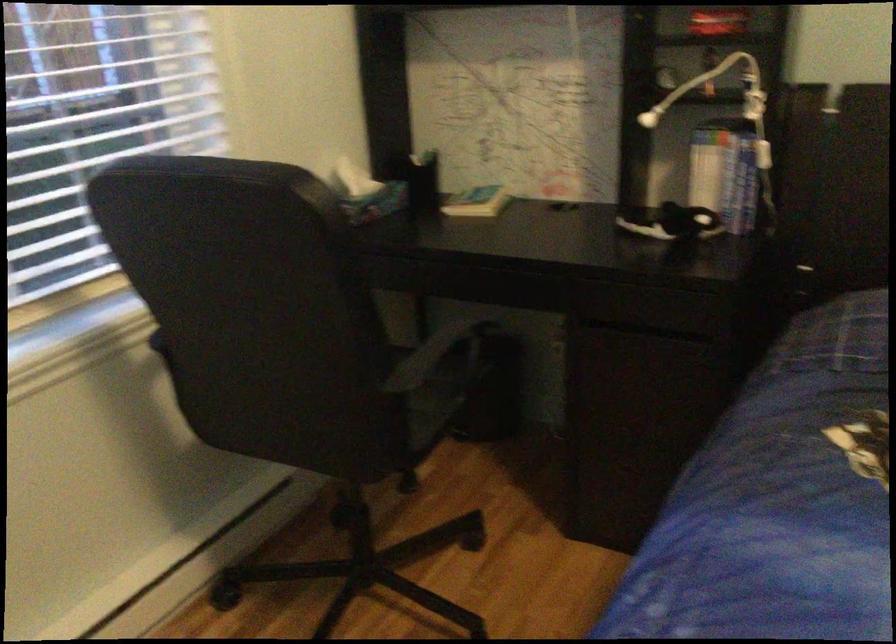
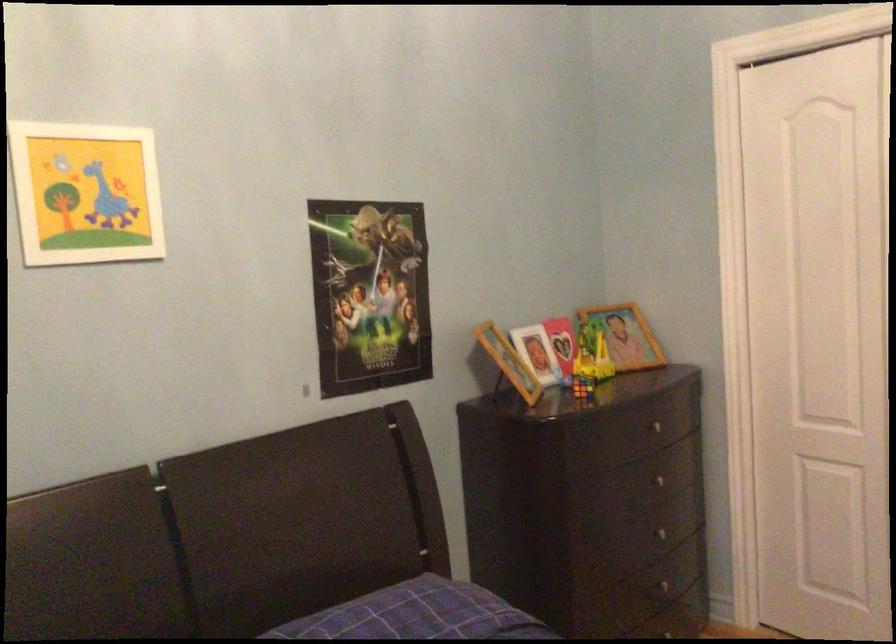
Question: How did the camera likely rotate?

Choices:
 (A) Left
 (B) Right
 (C) Up
 (D) Down

Answer: (B)